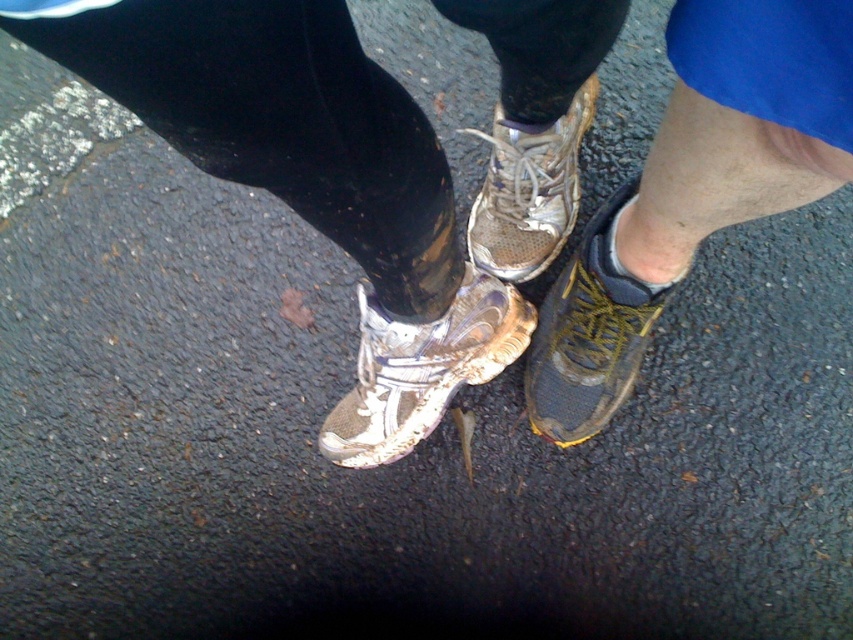
Question: Which object is the closest to the shiny black shoe at lower right?

Choices:
 (A) shiny white running shoe at center
 (B) worn leather shoe at center

Answer: (A)

Question: Can you confirm if shiny white running shoe at center is thinner than worn leather shoe at center?

Choices:
 (A) yes
 (B) no

Answer: (B)

Question: Among these objects, which one is farthest from the camera?

Choices:
 (A) shiny white running shoe at center
 (B) worn leather shoe at center

Answer: (B)

Question: Based on their relative distances, which object is nearer to the shiny white running shoe at center?

Choices:
 (A) shiny black shoe at lower right
 (B) worn leather shoe at center

Answer: (A)

Question: Is shiny black shoe at lower right closer to the viewer compared to worn leather shoe at center?

Choices:
 (A) no
 (B) yes

Answer: (B)

Question: Considering the relative positions of shiny white running shoe at center and worn leather shoe at center in the image provided, where is shiny white running shoe at center located with respect to worn leather shoe at center?

Choices:
 (A) right
 (B) left

Answer: (B)